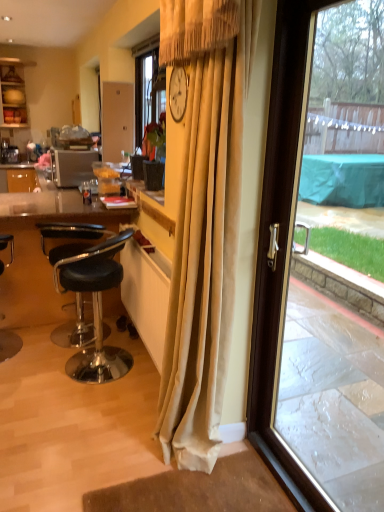
In order to click on matte black flowerpot at center in this screenshot , I will do (x=153, y=175).

Find the location of a particular element. Image resolution: width=384 pixels, height=512 pixels. satin silver toaster at left is located at coordinates (73, 167).

Where is `transparent glass door at right`? transparent glass door at right is located at coordinates (318, 286).

Identify the location of black leather stool at left, positioned as the first chair in right-to-left order. The width and height of the screenshot is (384, 512). (95, 307).

Describe the element at coordinates (13, 96) in the screenshot. I see `matte brown plate at upper left` at that location.

You are a GUI agent. You are given a task and a screenshot of the screen. Output one action in this format:
    pyautogui.click(x=<x>, y=<y>)
    Task: Click on the matte black flowerpot at center
    
    Given the screenshot: What is the action you would take?
    pyautogui.click(x=153, y=175)

Is matte wood cabinet at upper left positioned beyond the bounds of black leather stool at left, positioned as the first chair in right-to-left order?

Yes, matte wood cabinet at upper left is located beyond the bounds of black leather stool at left, positioned as the first chair in right-to-left order.

Starting from the matte wood cabinet at upper left, which chair is the 2nd one to the right? Please provide its 2D coordinates.

[(95, 307)]

Based on the photo, how distant is matte wood cabinet at upper left from black leather stool at left, the 2th chair when ordered from left to right?

The distance of matte wood cabinet at upper left from black leather stool at left, the 2th chair when ordered from left to right, is 3.53 meters.

Is matte wood cabinet at upper left facing towards black leather stool at left, positioned as the first chair in right-to-left order?

Yes, matte wood cabinet at upper left faces towards black leather stool at left, positioned as the first chair in right-to-left order.

Can you confirm if transparent glass door at right is thinner than black leather stool at lower left, the 1th chair from the left?

Correct, the width of transparent glass door at right is less than that of black leather stool at lower left, the 1th chair from the left.

Measure the distance between transparent glass door at right and black leather stool at lower left, which is the 2th chair from right to left.

transparent glass door at right is 6.98 feet from black leather stool at lower left, which is the 2th chair from right to left.

Where is `door above the black leather stool at lower left, which is the 2th chair from right to left (from the image's perspective)`? The image size is (384, 512). door above the black leather stool at lower left, which is the 2th chair from right to left (from the image's perspective) is located at coordinates (318, 286).

Can we say transparent glass door at right lies outside black leather stool at lower left, which is the 2th chair from right to left?

Yes, transparent glass door at right is not within black leather stool at lower left, which is the 2th chair from right to left.

In the scene shown: Is black leather stool at left, the 2th chair when ordered from left to right, with transparent glass door at right?

No, black leather stool at left, the 2th chair when ordered from left to right, is not touching transparent glass door at right.

Considering the sizes of objects black leather stool at left, positioned as the first chair in right-to-left order, and transparent glass door at right in the image provided, who is taller, black leather stool at left, positioned as the first chair in right-to-left order, or transparent glass door at right?

transparent glass door at right.

Which object is positioned more to the left, black leather stool at left, the 2th chair when ordered from left to right, or transparent glass door at right?

black leather stool at left, the 2th chair when ordered from left to right, is more to the left.

Does black leather stool at left, the 2th chair when ordered from left to right, have a smaller size compared to transparent glass door at right?

No.

This screenshot has width=384, height=512. Identify the location of cabinetry that is above the black leather stool at left, positioned as the first chair in right-to-left order (from the image's perspective). (13, 93).

Which point is more forward, (98, 350) or (8, 102)?

The point (98, 350) is in front.

Is black leather stool at left, positioned as the first chair in right-to-left order, directly adjacent to matte wood cabinet at upper left?

No.

How much distance is there between black leather stool at left, positioned as the first chair in right-to-left order, and matte wood cabinet at upper left?

black leather stool at left, positioned as the first chair in right-to-left order, and matte wood cabinet at upper left are 3.53 meters apart.

Considering the sizes of objects beige velvet curtain at center and black leather stool at lower left, which is the 2th chair from right to left, in the image provided, who is thinner, beige velvet curtain at center or black leather stool at lower left, which is the 2th chair from right to left,?

With smaller width is beige velvet curtain at center.

Which object is positioned more to the right, beige velvet curtain at center or black leather stool at lower left, which is the 2th chair from right to left?

beige velvet curtain at center is more to the right.

The width and height of the screenshot is (384, 512). I want to click on curtain on the right of black leather stool at lower left, the 1th chair from the left, so click(x=204, y=221).

Is beige velvet curtain at center inside the boundaries of black leather stool at lower left, the 1th chair from the left, or outside?

beige velvet curtain at center exists outside the volume of black leather stool at lower left, the 1th chair from the left.

From a real-world perspective, is matte wood cabinet at upper left positioned above or below satin silver microwave at left?

Clearly, from a real-world perspective, matte wood cabinet at upper left is above satin silver microwave at left.

In the scene shown: Is matte wood cabinet at upper left surrounding satin silver microwave at left?

No, satin silver microwave at left is not inside matte wood cabinet at upper left.

Is matte wood cabinet at upper left further to the viewer compared to satin silver microwave at left?

No, it is in front of satin silver microwave at left.

Is matte wood cabinet at upper left taller than satin silver microwave at left?

Yes, matte wood cabinet at upper left is taller than satin silver microwave at left.

Who is shorter, matte brown plate at upper left or matte black flowerpot at center?

matte brown plate at upper left.

Does point (22, 95) come farther from viewer compared to point (152, 183)?

Yes, point (22, 95) is behind point (152, 183).

Does matte brown plate at upper left have a greater width compared to matte black flowerpot at center?

Yes.

In the scene shown: What's the angular difference between matte brown plate at upper left and matte black flowerpot at center's facing directions?

88.2 degrees.

Identify the location of the 2nd chair counting from the right of the matte wood cabinet at upper left. This screenshot has height=512, width=384. (95, 307).

From a real-world perspective, which chair is the 2nd one underneath the transparent glass door at right? Please provide its 2D coordinates.

[(9, 344)]

From the image, which object appears to be farther from transparent glass door at right, matte black flowerpot at center or matte brown plate at upper left?

matte brown plate at upper left is positioned further to the anchor transparent glass door at right.

Based on their spatial positions, is matte black flowerpot at center or matte wood cabinet at upper left further from matte brown plate at upper left?

Among the two, matte black flowerpot at center is located further to matte brown plate at upper left.

Estimate the real-world distances between objects in this image. Which object is further from black leather stool at left, positioned as the first chair in right-to-left order, black leather stool at lower left, which is the 2th chair from right to left, or transparent glass door at right?

Based on the image, transparent glass door at right appears to be further to black leather stool at left, positioned as the first chair in right-to-left order.

Looking at the image, which one is located further to black leather stool at lower left, which is the 2th chair from right to left, satin silver microwave at left or satin silver toaster at left?

Based on the image, satin silver microwave at left appears to be further to black leather stool at lower left, which is the 2th chair from right to left.

Looking at the image, which one is located further to matte brown plate at upper left, black leather stool at left, the 2th chair when ordered from left to right, or satin silver microwave at left?

black leather stool at left, the 2th chair when ordered from left to right, is further to matte brown plate at upper left.

When comparing their distances from beige velvet curtain at center, does satin silver microwave at left or black leather stool at lower left, the 1th chair from the left, seem further?

satin silver microwave at left.

From the image, which object appears to be nearer to black leather stool at left, positioned as the first chair in right-to-left order, beige velvet curtain at center or matte brown plate at upper left?

beige velvet curtain at center lies closer to black leather stool at left, positioned as the first chair in right-to-left order, than the other object.

From the image, which object appears to be nearer to black leather stool at lower left, which is the 2th chair from right to left, matte black flowerpot at center or satin silver microwave at left?

matte black flowerpot at center.

I want to click on cabinetry positioned between beige velvet curtain at center and matte brown plate at upper left from near to far, so click(13, 93).

Locate an element on the screen. The width and height of the screenshot is (384, 512). cabinetry between beige velvet curtain at center and satin silver microwave at left in the front-back direction is located at coordinates (13, 93).

At what (x,y) coordinates should I click in order to perform the action: click on curtain between transparent glass door at right and black leather stool at left, the 2th chair when ordered from left to right, from front to back. Please return your answer as a coordinate pair (x, y). The image size is (384, 512). Looking at the image, I should click on (204, 221).

You are a GUI agent. You are given a task and a screenshot of the screen. Output one action in this format:
    pyautogui.click(x=<x>, y=<y>)
    Task: Click on the curtain positioned between transparent glass door at right and satin silver toaster at left from near to far
    The height and width of the screenshot is (512, 384).
    Given the screenshot: What is the action you would take?
    pyautogui.click(x=204, y=221)